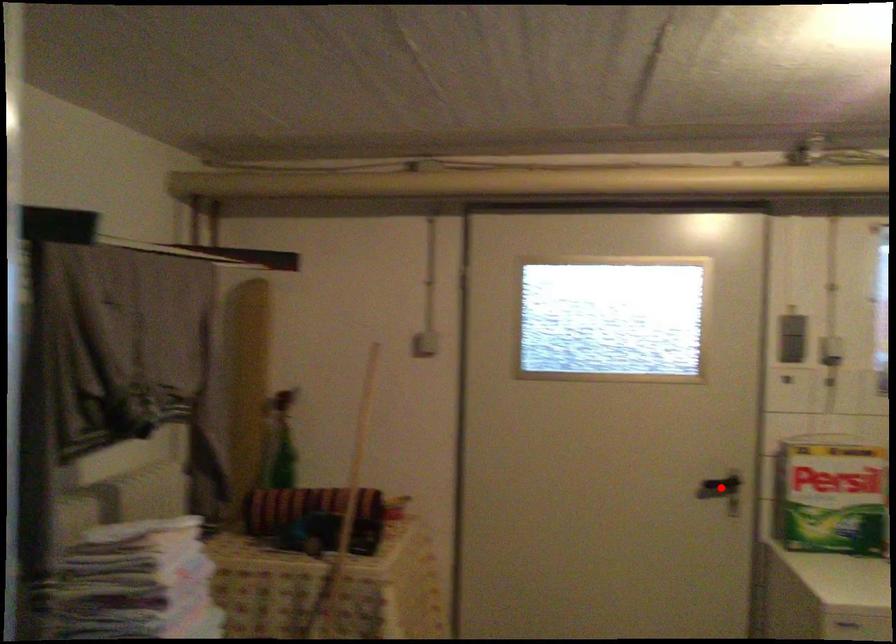
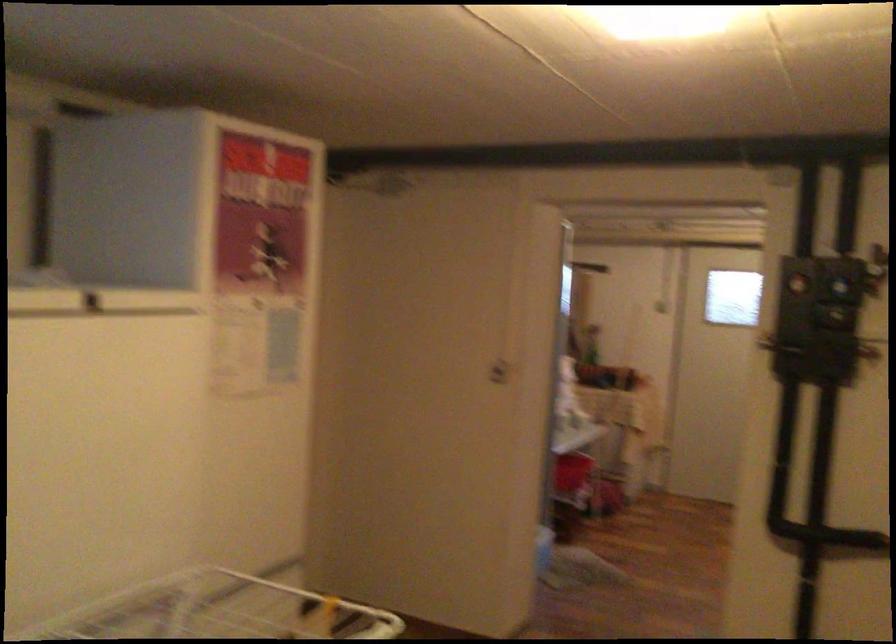
Question: I am providing you with two images of the same scene from different viewpoints. A red point is marked on the first image. Can you still see the location of the red point in image 2?

Choices:
 (A) Yes
 (B) No

Answer: (B)